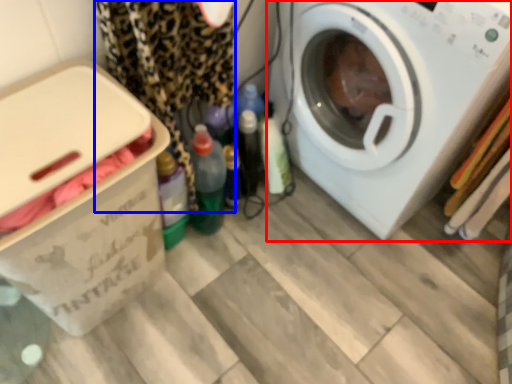
Question: Among these objects, which one is farthest to the camera, washing machine (highlighted by a red box) or clothing (highlighted by a blue box)?

Choices:
 (A) washing machine
 (B) clothing

Answer: (A)